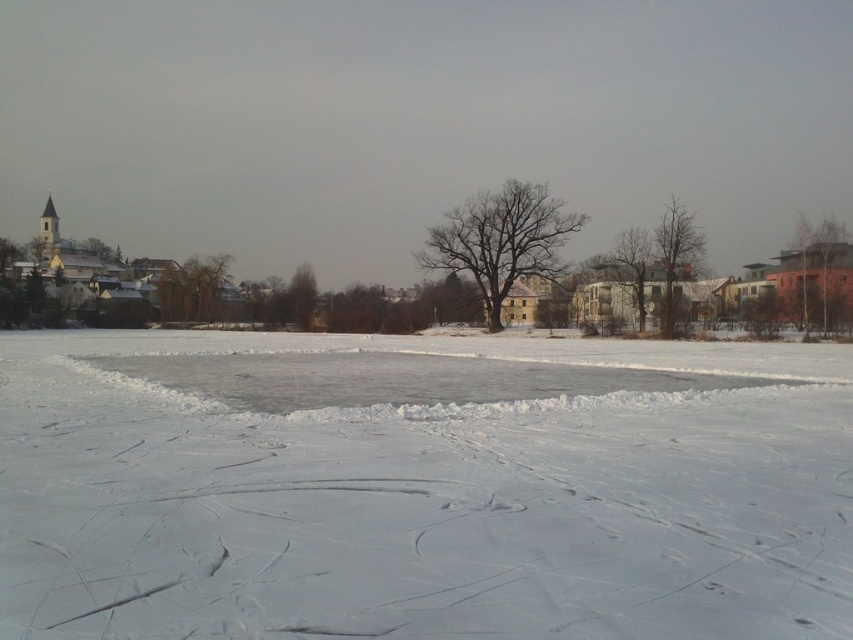
You are an observer standing in the winter landscape. You notice two features at the center of the image. Which one is thinner between the bare brown tree at center and the bare branches at center?

The bare brown tree at center is thinner than the bare branches at center.

You are standing in the winter landscape and want to take a photo of the bare branches at right. Where should you position yourself to capture them in the frame?

To capture the bare branches at right in the frame, position yourself at the 2D coordinates point (675, 253).

You are standing at the frozen lake edge in the winter scene. There is a point marked at coordinates (421, 486) which is white powdery snow at center. If you walk straight towards the center of the frozen lake, will you step on the white powdery snow at center? Explain your reasoning using the scene description.

Yes, walking straight towards the center of the frozen lake from the edge would lead you to the white powdery snow at center marked by the point (421, 486), as the coordinates indicate its position at the center.